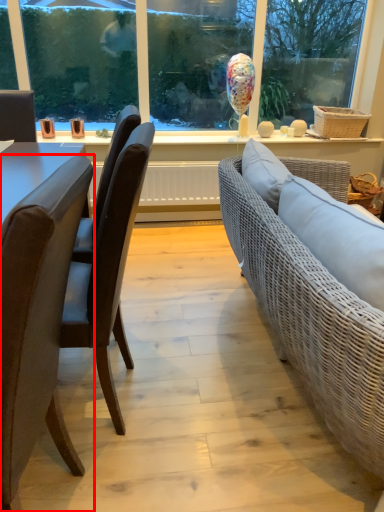
Question: From the image's perspective, where is chair (annotated by the red box) located in relation to chair in the image?

Choices:
 (A) above
 (B) below

Answer: (B)